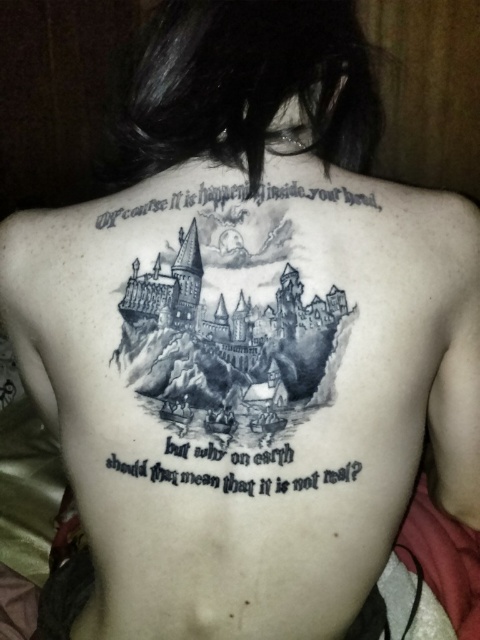
Does black ink text at center have a lesser height compared to black ink text at upper center?

In fact, black ink text at center may be taller than black ink text at upper center.

Does point (272, 460) lie behind point (354, 192)?

No, it is not.

The width and height of the screenshot is (480, 640). What are the coordinates of `black ink text at center` in the screenshot? It's located at (233, 477).